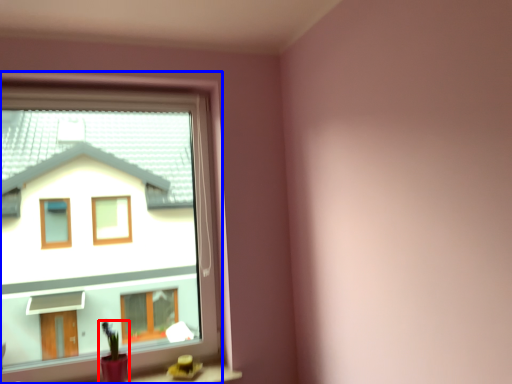
Question: Among these objects, which one is nearest to the camera, houseplant (highlighted by a red box) or window (highlighted by a blue box)?

Choices:
 (A) houseplant
 (B) window

Answer: (B)